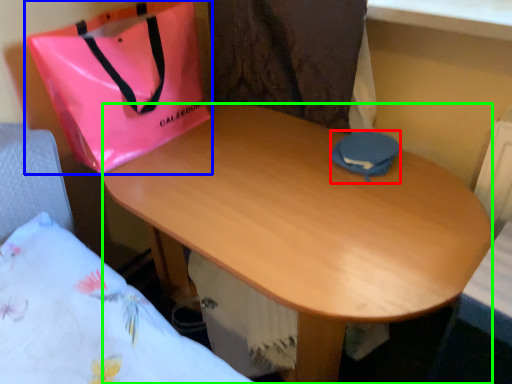
Question: Based on their relative distances, which object is farther from pouch (highlighted by a red box)? Choose from handbag (highlighted by a blue box) and desk (highlighted by a green box).

Choices:
 (A) handbag
 (B) desk

Answer: (A)